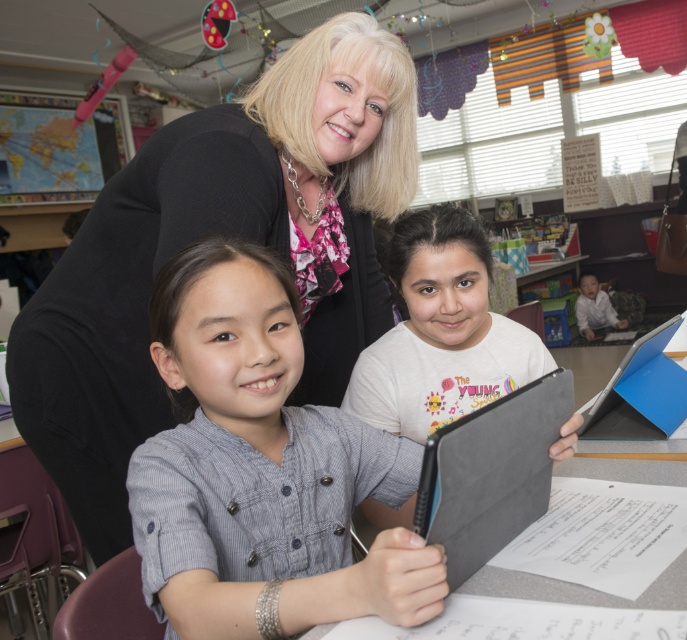
You are a teacher in the classroom and need to reach both the black fabric at upper center and the matte gray tablet at center. If you can only move 25 centimeters from your current position, can you reach both objects without moving further?

The black fabric at upper center and matte gray tablet at center are 30.41 centimeters apart. Since you can only move 25 centimeters, you cannot reach both objects without moving further.